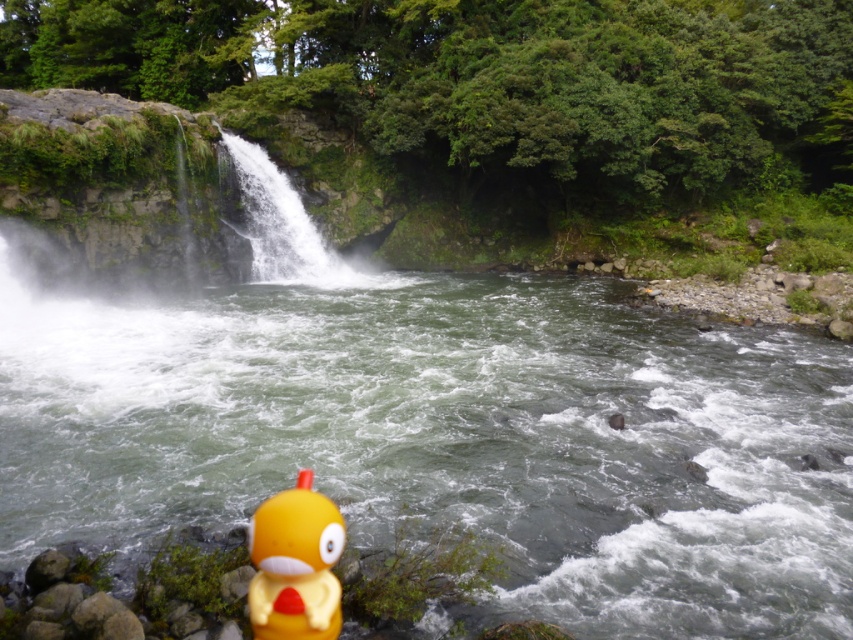
You are a hiker who wants to place a GPS tracker on the green rubber duck at lower center. The tracker has a range of 15 meters. Can the tracker detect the white frothy water at center from the duck?

The green rubber duck at lower center and white frothy water at center are 13.89 meters apart, so yes, the tracker can detect the white frothy water at center since it is within the 15 meter range.

You are standing at the edge of the river and see both the green rubber duck at lower center and the yellow rubber duck at lower left. Which duck is positioned more to the left?

The green rubber duck at lower center is positioned more to the left than the yellow rubber duck at lower left.

You are a hiker who wants to place a new rubber duck between the green rubber duck at lower center and the yellow rubber duck at lower left. The new duck requires a minimum of 10 meters of space between it and each existing duck. Is this possible?

The distance between the green rubber duck at lower center and the yellow rubber duck at lower left is 12.22 meters. Since the new duck needs at least 10 meters from each, placing it exactly in the middle would leave 6.11 meters between it and each existing duck, which is less than the required 10 meters. Therefore, it is not possible to place the new duck with the required spacing.